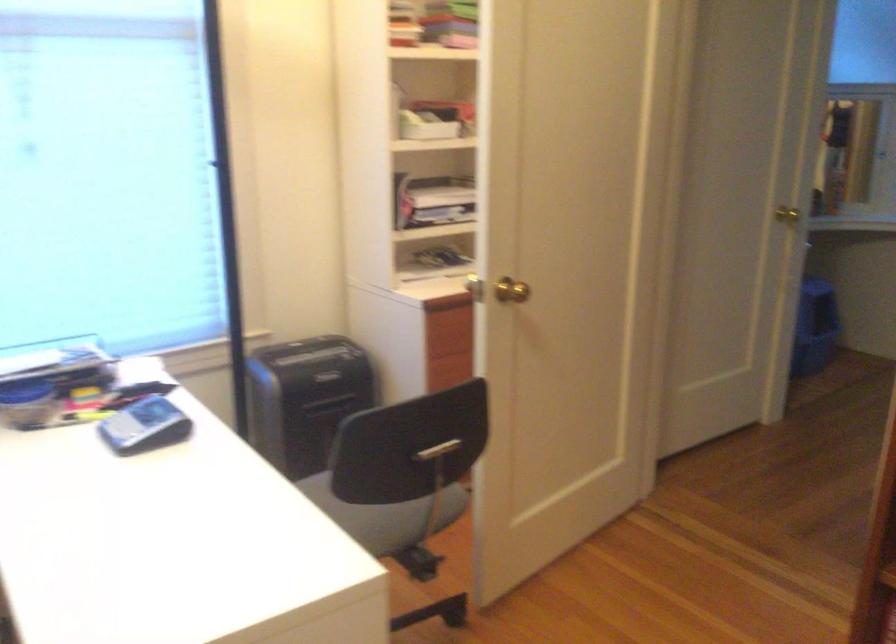
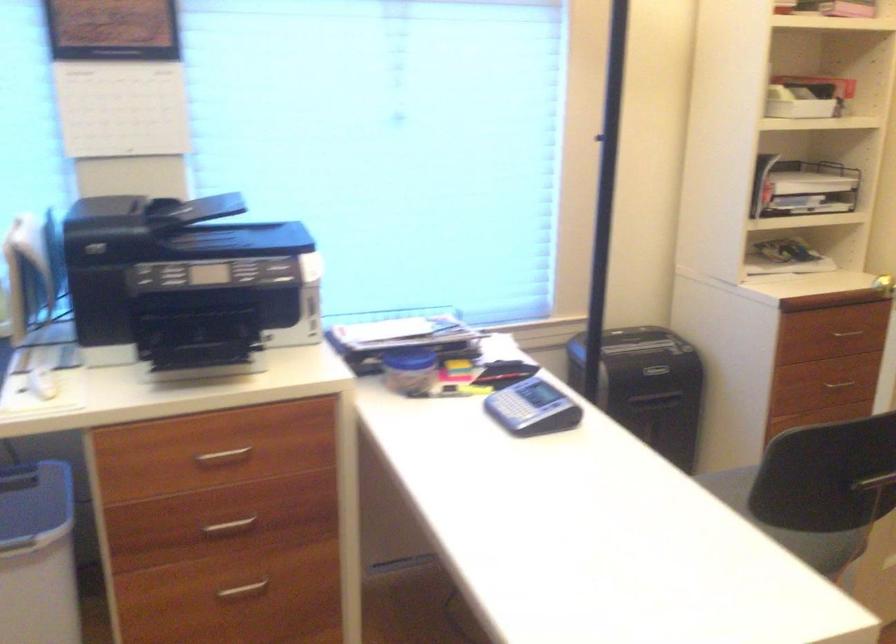
Question: The camera is either moving clockwise (left) or counter-clockwise (right) around the object. The first image is from the beginning of the video and the second image is from the end. Is the camera moving left or right when shooting the video?

Choices:
 (A) Left
 (B) Right

Answer: (B)